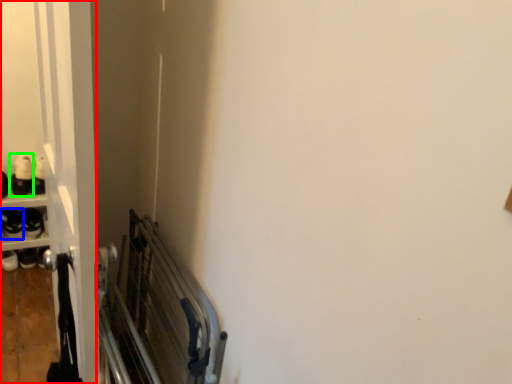
Question: Which object is positioned closest to door (highlighted by a red box)? Select from footwear (highlighted by a blue box) and footwear (highlighted by a green box).

Choices:
 (A) footwear
 (B) footwear

Answer: (B)